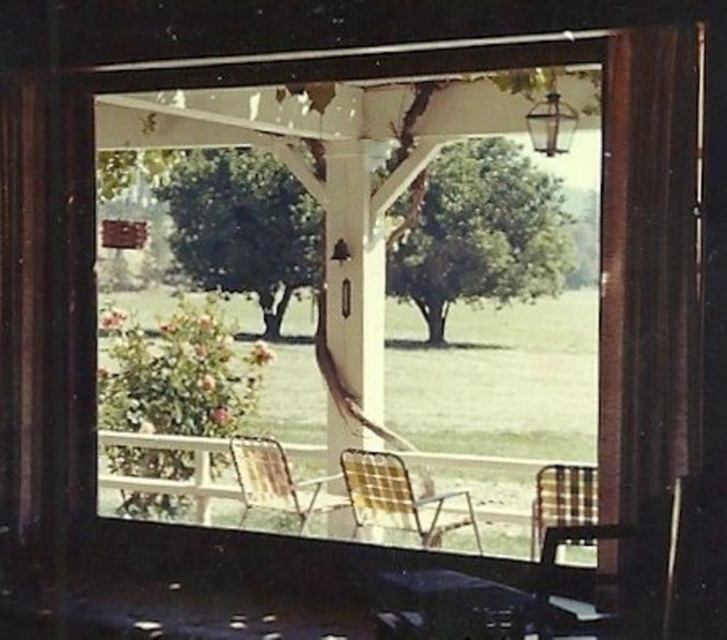
Question: Based on their relative distances, which object is nearer to the plaid fabric rocking chair at lower right?

Choices:
 (A) plaid fabric chair at center
 (B) plaid fabric chairs at center
 (C) plaid fabric chair at right

Answer: (C)

Question: Can you confirm if plaid fabric chairs at center is positioned to the right of plaid fabric chair at center?

Choices:
 (A) yes
 (B) no

Answer: (B)

Question: Which of these objects is positioned closest to the plaid fabric rocking chair at lower right?

Choices:
 (A) plaid fabric chair at center
 (B) plaid fabric chairs at center

Answer: (A)

Question: Which point appears farthest from the camera in this image?

Choices:
 (A) (550, 468)
 (B) (300, 508)
 (C) (430, 518)
 (D) (569, 532)

Answer: (B)

Question: Is rustic wood chair at center positioned in front of plaid fabric chair at right?

Choices:
 (A) yes
 (B) no

Answer: (B)

Question: Considering the relative positions of plaid fabric chairs at center and rustic wood chair at center in the image provided, where is plaid fabric chairs at center located with respect to rustic wood chair at center?

Choices:
 (A) below
 (B) above

Answer: (B)